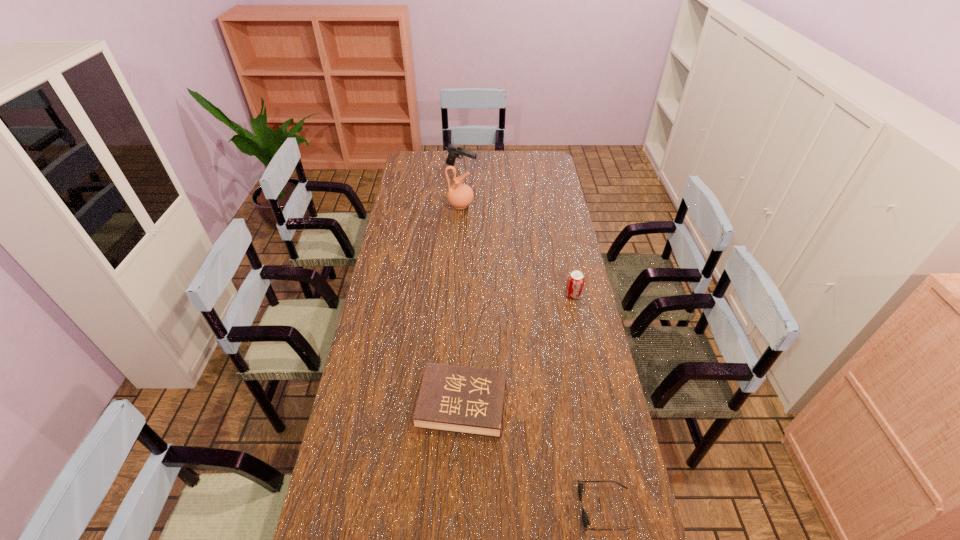
Where is `vacant region located 0.340m on the spout of the pottery`? The width and height of the screenshot is (960, 540). vacant region located 0.340m on the spout of the pottery is located at coordinates (x=545, y=205).

At what (x,y) coordinates should I click in order to perform the action: click on vacant space located 0.260m at the muzzle of the gun. Please return your answer as a coordinate pair (x, y). Looking at the image, I should click on (526, 169).

You are a GUI agent. You are given a task and a screenshot of the screen. Output one action in this format:
    pyautogui.click(x=<x>, y=<y>)
    Task: Click on the vacant space situated 0.130m on the front of the soda
    
    Given the screenshot: What is the action you would take?
    pyautogui.click(x=580, y=328)

This screenshot has width=960, height=540. I want to click on free space located 0.060m on the back of the hardback book, so click(x=464, y=357).

At what (x,y) coordinates should I click in order to perform the action: click on free space located on the front-facing side of the sunglasses. Please return your answer as a coordinate pair (x, y). The width and height of the screenshot is (960, 540). Looking at the image, I should click on (454, 508).

Locate an element on the screen. The image size is (960, 540). vacant space located on the front-facing side of the sunglasses is located at coordinates (537, 508).

Where is `free space located on the front-facing side of the sunglasses`? The width and height of the screenshot is (960, 540). free space located on the front-facing side of the sunglasses is located at coordinates (454, 508).

The image size is (960, 540). I want to click on object that is positioned at the far edge, so [454, 151].

What are the coordinates of `soda that is at the right edge` in the screenshot? It's located at (575, 283).

Locate an element on the screen. This screenshot has width=960, height=540. sunglasses located in the right edge section of the desktop is located at coordinates (585, 520).